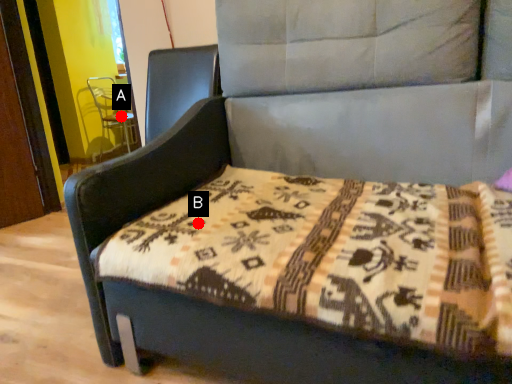
Question: Two points are circled on the image, labeled by A and B beside each circle. Which of the following is the closest to the observer?

Choices:
 (A) A is closer
 (B) B is closer

Answer: (B)